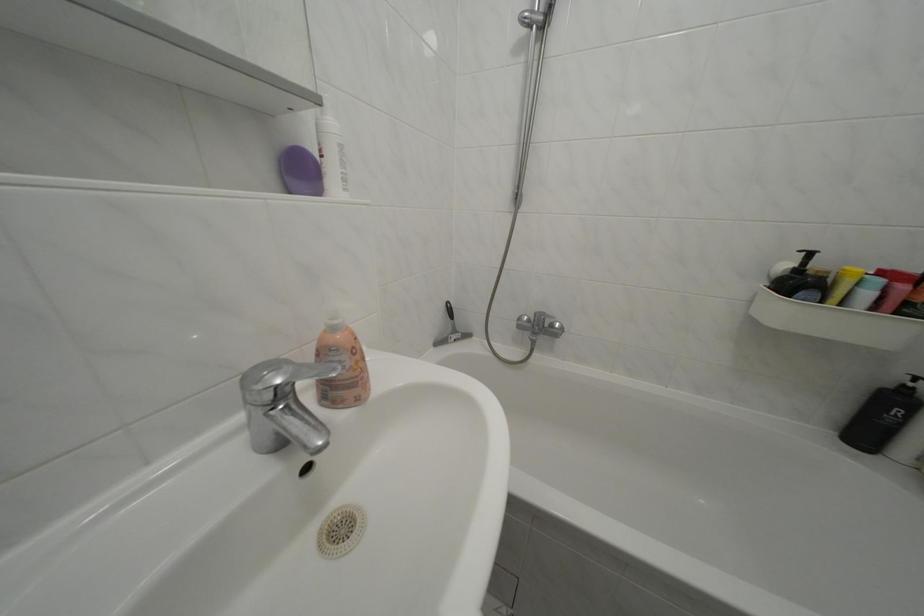
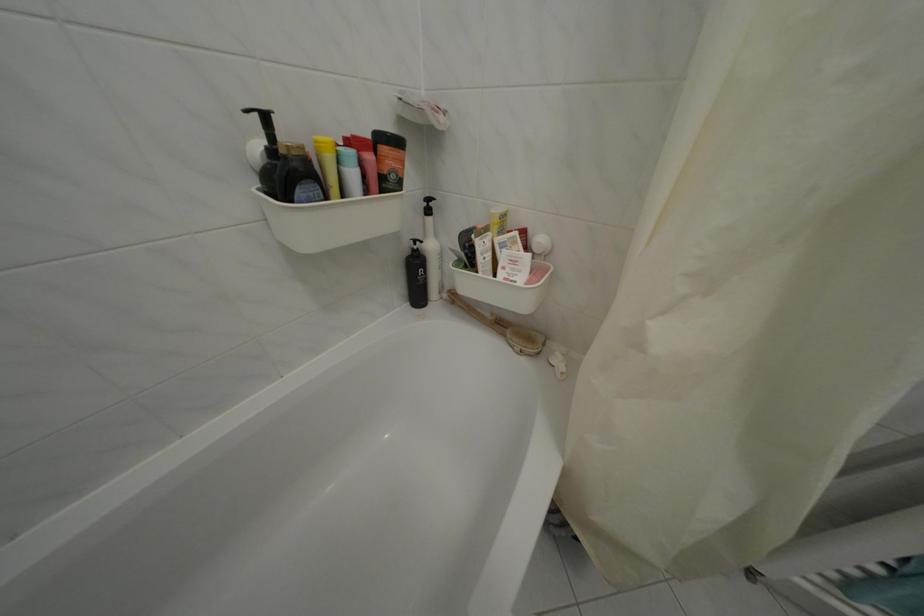
Find the pixel in the second image that matches (891,305) in the first image.

(372, 182)